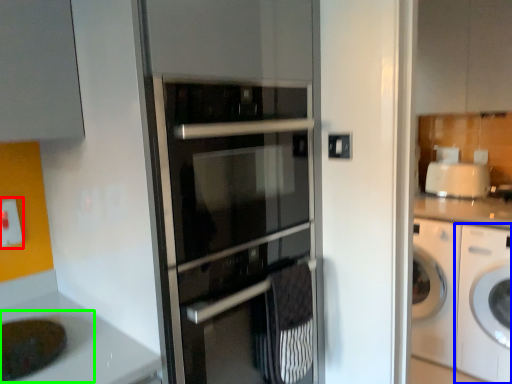
Question: Estimate the real-world distances between objects in this image. Which object is closer to electric outlet (highlighted by a red box), washing machine (highlighted by a blue box) or sink (highlighted by a green box)?

Choices:
 (A) washing machine
 (B) sink

Answer: (B)